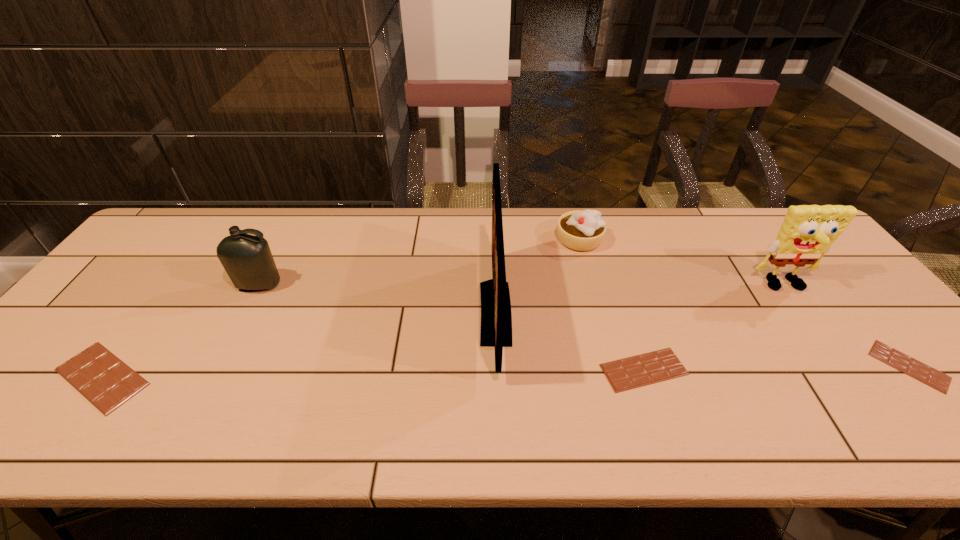
Locate an element on the screen. monitor is located at coordinates (496, 318).

You are a GUI agent. You are given a task and a screenshot of the screen. Output one action in this format:
    pyautogui.click(x=<x>, y=<y>)
    Task: Click on the free space located 0.330m on the back of the leftmost chocolate bar
    
    Given the screenshot: What is the action you would take?
    pyautogui.click(x=192, y=255)

You are a GUI agent. You are given a task and a screenshot of the screen. Output one action in this format:
    pyautogui.click(x=<x>, y=<y>)
    Task: Click on the vacant space positioned 0.380m on the left of the second chocolate bar from right to left
    Image resolution: width=960 pixels, height=540 pixels.
    Given the screenshot: What is the action you would take?
    pyautogui.click(x=436, y=370)

I want to click on vacant space located on the left of the farthest object, so click(x=469, y=240).

Where is `vacant space situated on the right of the fifth shortest object`? Image resolution: width=960 pixels, height=540 pixels. vacant space situated on the right of the fifth shortest object is located at coordinates (332, 285).

Locate an element on the screen. vacant space located 0.200m on the face of the second tallest object is located at coordinates (836, 357).

Find the location of `free space located on the front-facing side of the third object from left to right`. free space located on the front-facing side of the third object from left to right is located at coordinates (430, 313).

Where is `vacant space located on the front-facing side of the third object from left to right`? This screenshot has height=540, width=960. vacant space located on the front-facing side of the third object from left to right is located at coordinates (430, 313).

Locate an element on the screen. The height and width of the screenshot is (540, 960). free space located on the front-facing side of the third object from left to right is located at coordinates (419, 313).

Locate an element on the screen. Image resolution: width=960 pixels, height=540 pixels. object positioned at the far edge is located at coordinates (581, 230).